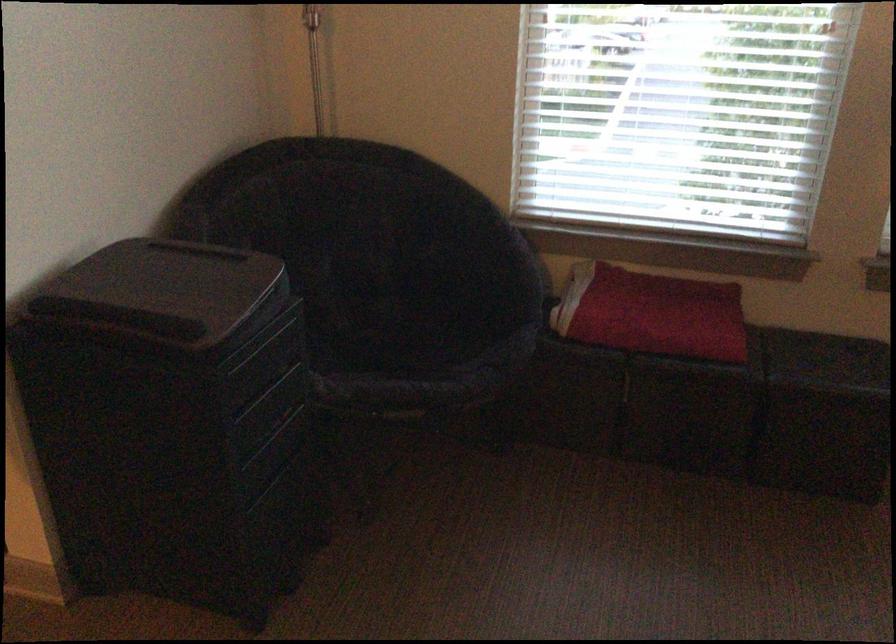
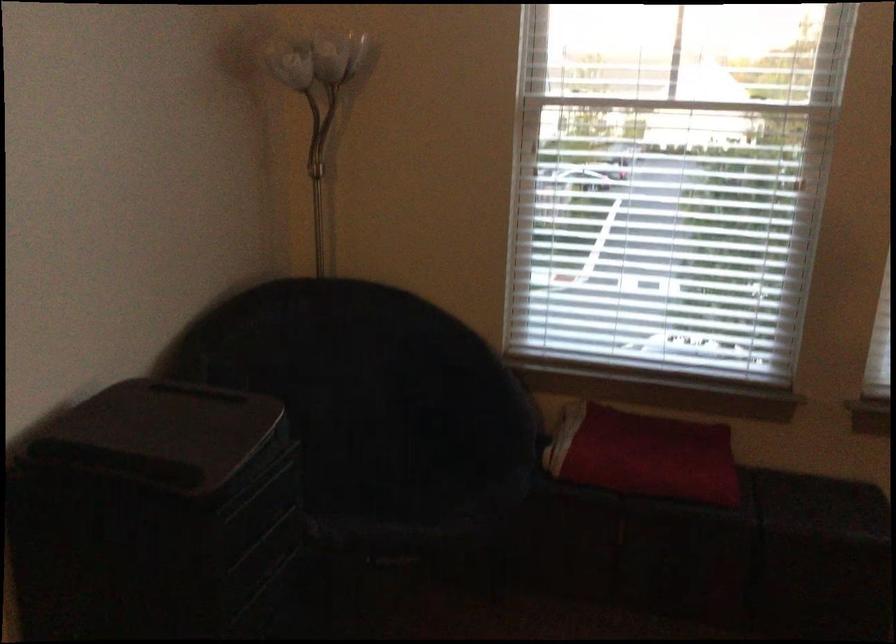
Question: Based on the continuous images, in which direction is the camera rotating? Reply with the corresponding letter.

Choices:
 (A) Left
 (B) Right
 (C) Up
 (D) Down

Answer: (C)